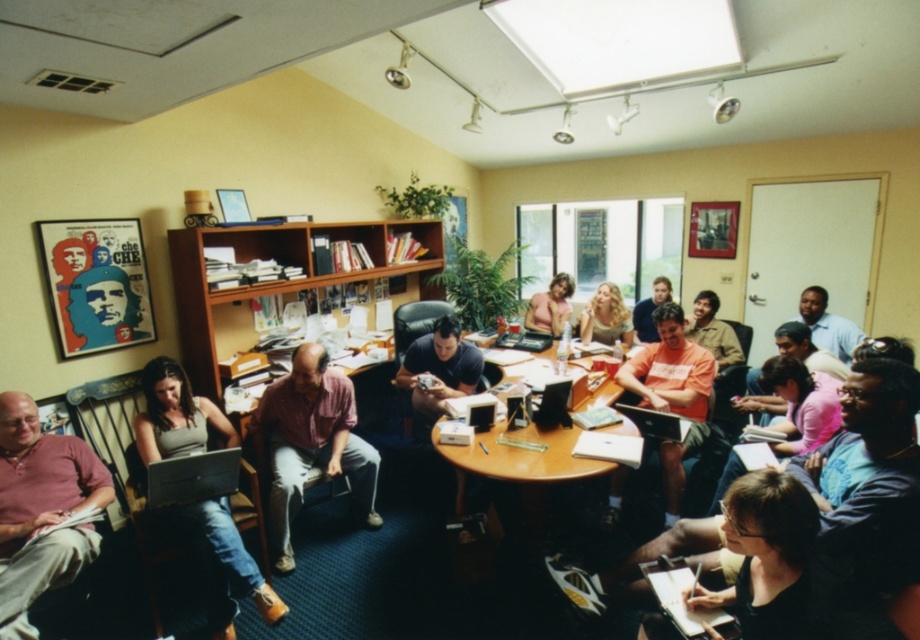
Is matte gray laptop at center left positioned at the back of orange cotton shirt at center?

No, it is in front of orange cotton shirt at center.

Does point (141, 426) lie behind point (634, 380)?

No, (141, 426) is in front of (634, 380).

Identify the location of matte gray laptop at center left. (226, 564).

Who is shorter, orange cotton shirt at center or blonde hair at center?

blonde hair at center

Who is more forward, (693, 417) or (615, 337)?

Point (693, 417) is more forward.

At what (x,y) coordinates should I click in order to perform the action: click on orange cotton shirt at center. Please return your answer as a coordinate pair (x, y). Looking at the image, I should click on (671, 394).

Is wooden bookshelf at center behind wooden at center?

Yes.

Can you confirm if wooden bookshelf at center is shorter than wooden at center?

In fact, wooden bookshelf at center may be taller than wooden at center.

At what (x,y) coordinates should I click in order to perform the action: click on wooden bookshelf at center. Please return your answer as a coordinate pair (x, y). Image resolution: width=920 pixels, height=640 pixels. Looking at the image, I should click on (273, 282).